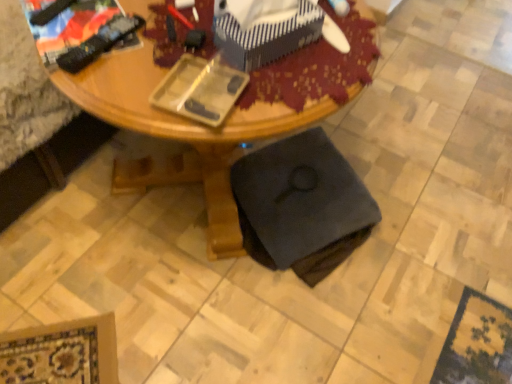
At what (x,y) coordinates should I click in order to perform the action: click on empty space that is in between wooden desk at center and black fabric swivel chair at lower center. Please return your answer as a coordinate pair (x, y). Image resolution: width=512 pixels, height=384 pixels. Looking at the image, I should click on (325, 274).